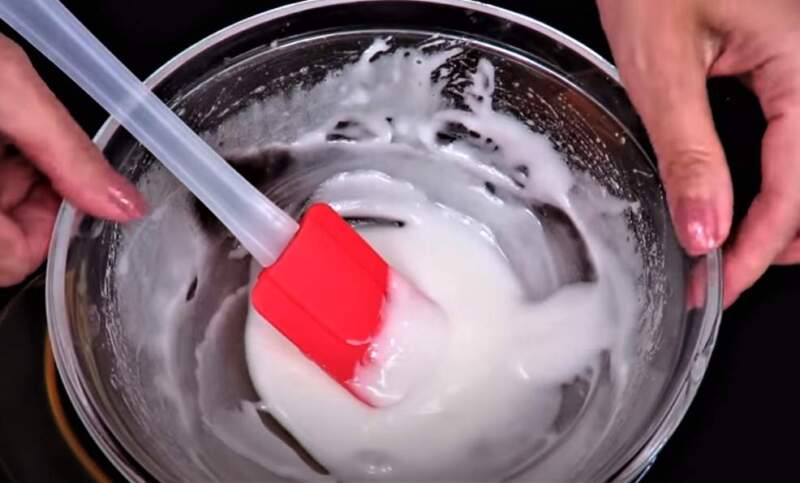
Find the location of `bowl`. bowl is located at coordinates (550, 185).